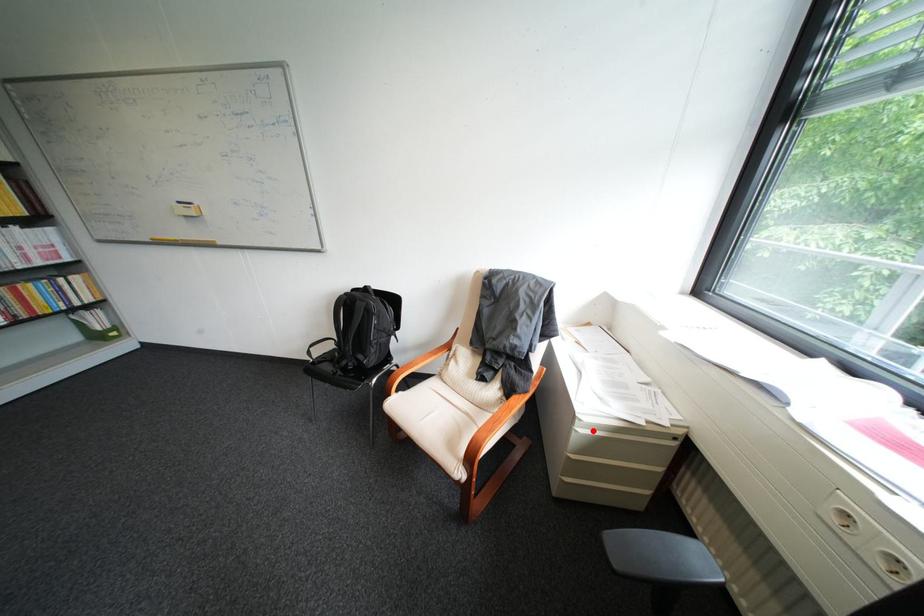
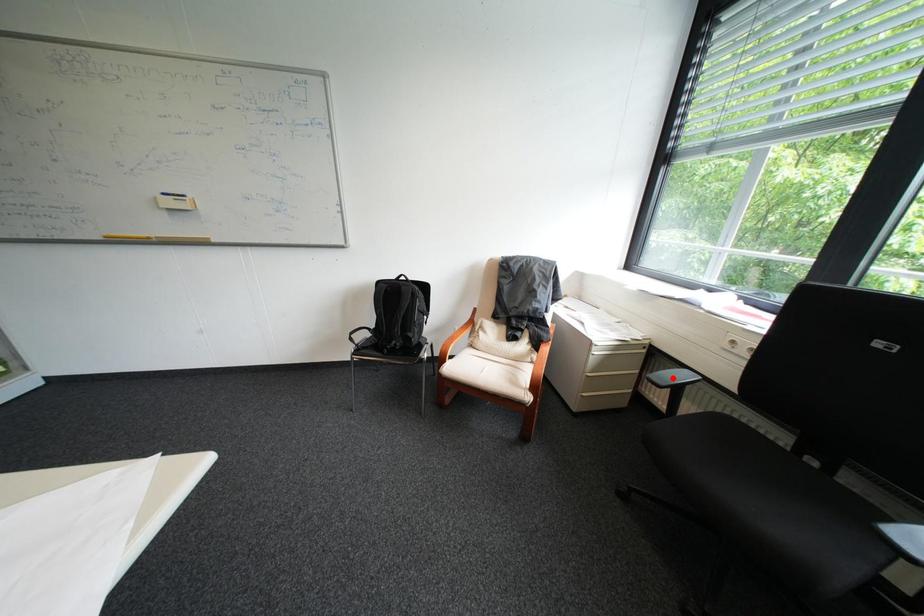
I am providing you with two images of the same scene from different viewpoints. A red point is marked on the first image and another point is marked on the second image. Does the point marked in image1 correspond to the same location as the one in image2?

No